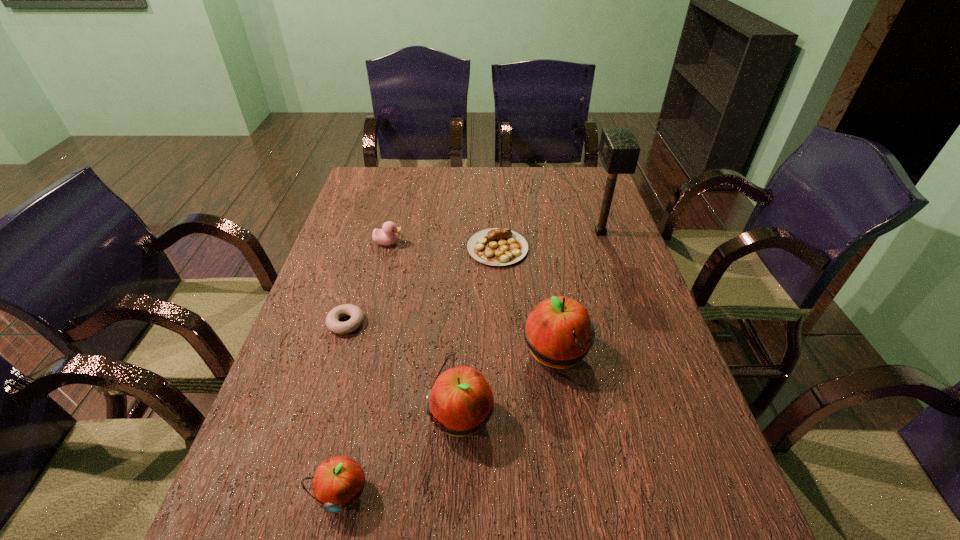
In order to click on vacant region that satisfies the following two spatial constraints: 1. on the front-facing side of the second shortest apple; 2. on the left side of the duckling in this screenshot , I will do `click(346, 416)`.

The height and width of the screenshot is (540, 960). Find the location of `free spot that satisfies the following two spatial constraints: 1. on the front-facing side of the duckling; 2. on the right side of the nearest object`. free spot that satisfies the following two spatial constraints: 1. on the front-facing side of the duckling; 2. on the right side of the nearest object is located at coordinates (325, 494).

Locate an element on the screen. The height and width of the screenshot is (540, 960). free space that satisfies the following two spatial constraints: 1. on the front-facing side of the duckling; 2. on the back side of the third tallest object is located at coordinates (346, 416).

The image size is (960, 540). What are the coordinates of `free point that satisfies the following two spatial constraints: 1. on the front side of the nearest apple; 2. on the left side of the doughnut` in the screenshot? It's located at (295, 494).

I want to click on free space that satisfies the following two spatial constraints: 1. on the front-facing side of the fifth shortest object; 2. on the left side of the duckling, so click(346, 416).

Where is `vacant area that satisfies the following two spatial constraints: 1. on the back side of the tallest object; 2. on the left side of the steak`? vacant area that satisfies the following two spatial constraints: 1. on the back side of the tallest object; 2. on the left side of the steak is located at coordinates [496, 233].